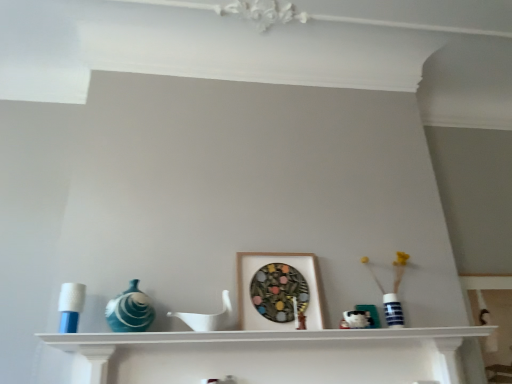
Locate an element on the screen. Image resolution: width=512 pixels, height=384 pixels. free location to the right of white glossy ceramic mug at center is located at coordinates (385, 337).